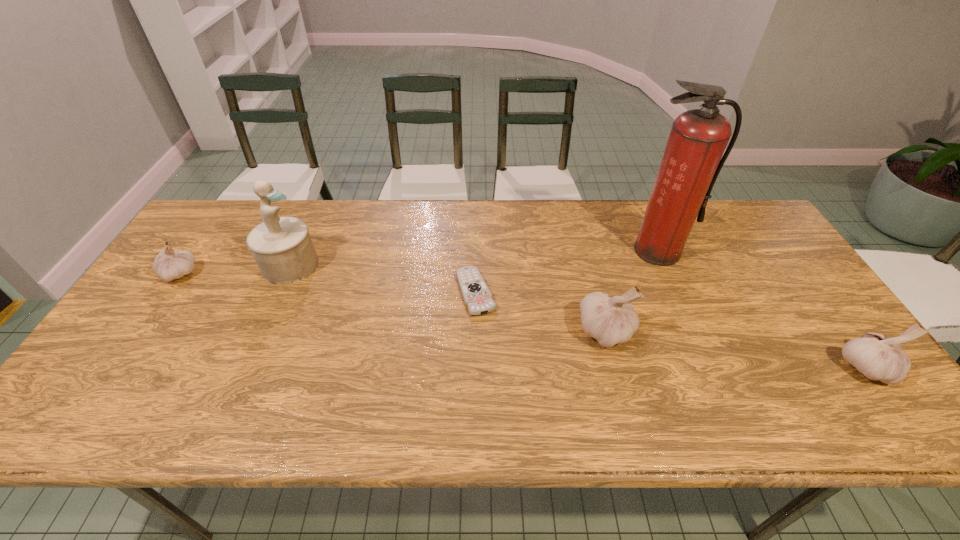
Identify the location of the leftmost garlic. This screenshot has height=540, width=960. (169, 264).

Where is `the leftmost object`? This screenshot has width=960, height=540. the leftmost object is located at coordinates (169, 264).

This screenshot has height=540, width=960. I want to click on the second garlic from right to left, so click(610, 321).

This screenshot has height=540, width=960. I want to click on the rightmost object, so click(x=877, y=357).

Locate an element on the screen. The image size is (960, 540). the fourth tallest object is located at coordinates (877, 357).

I want to click on remote control, so click(x=477, y=297).

Identify the location of the shortest object. (477, 297).

The width and height of the screenshot is (960, 540). I want to click on the fifth object from right to left, so click(x=282, y=247).

In order to click on figurine in this screenshot , I will do `click(282, 247)`.

The width and height of the screenshot is (960, 540). I want to click on the tallest object, so click(692, 160).